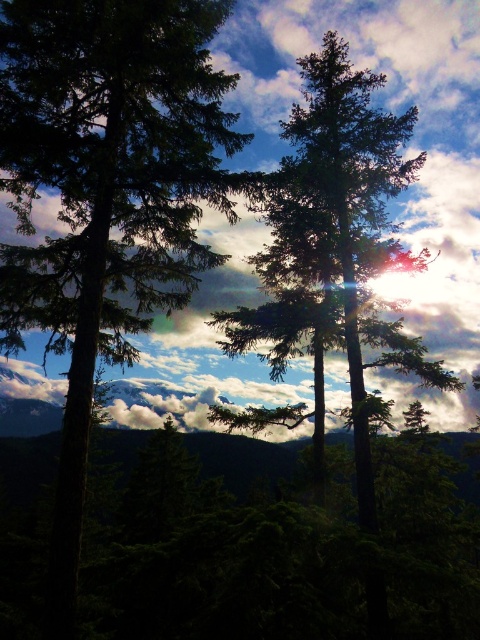
You are a bird flying over the forest. You want to land on the highest object between the white fluffy cloud at upper center and the green matte tree at center. Which one should you choose?

The white fluffy cloud at upper center is taller than the green matte tree at center, so you should choose the white fluffy cloud at upper center to land on as it is the highest object.

Based on the photo, you are a bird flying over the forest. You see the white fluffy cloud at upper center and the green matte tree at center. Which one is lower in the sky?

The white fluffy cloud at upper center is below the green matte tree at center, so the cloud is lower.